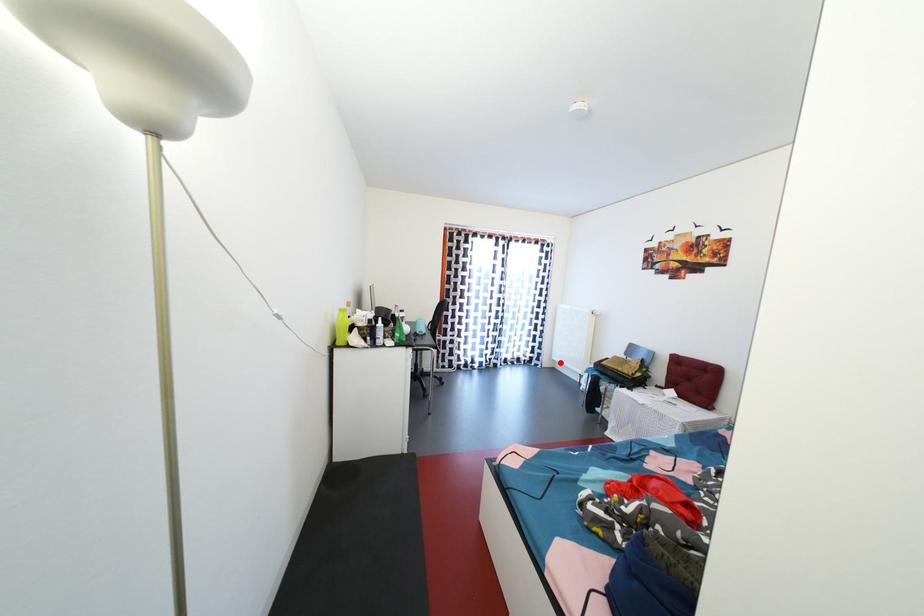
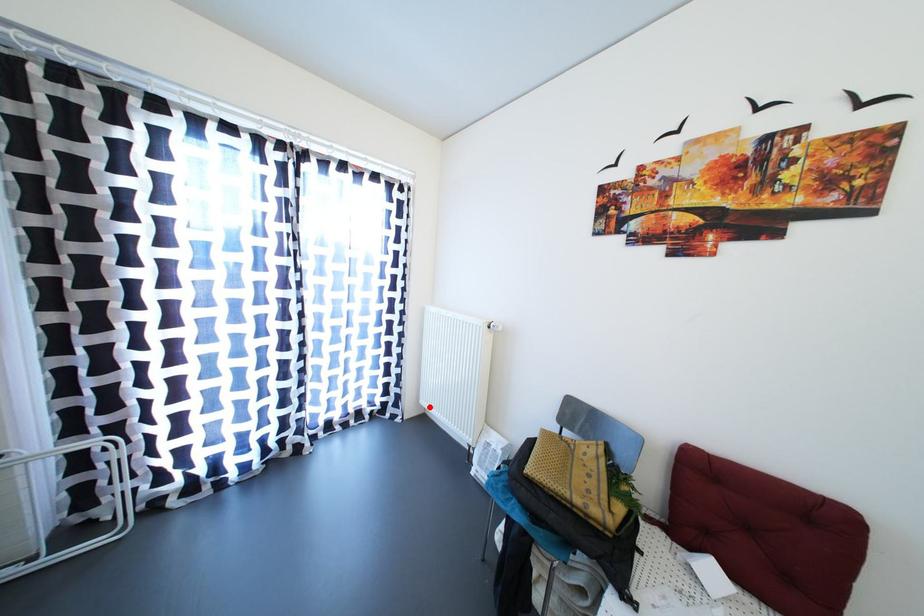
I am providing you with two images of the same scene from different viewpoints. A red point is marked on the first image and another point is marked on the second image. Is the red point in image1 aligned with the point shown in image2?

Yes